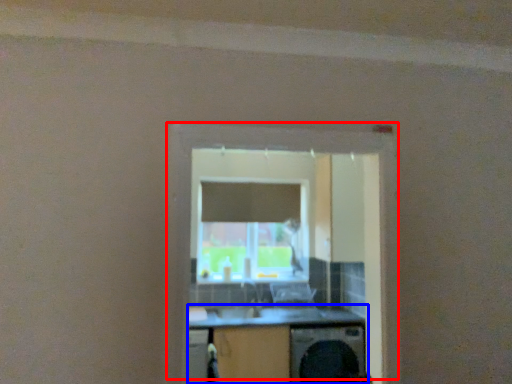
Question: Which object appears farthest to the camera in this image, window (highlighted by a red box) or computer desk (highlighted by a blue box)?

Choices:
 (A) window
 (B) computer desk

Answer: (B)